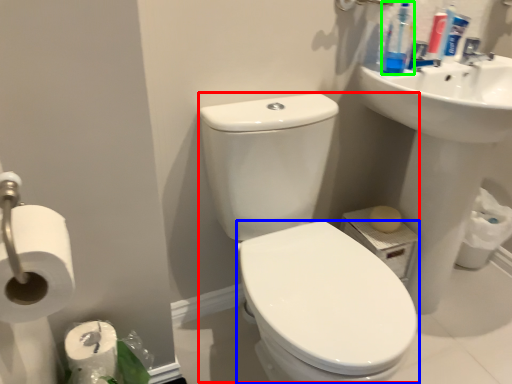
Question: Which object is positioned farthest from sink (highlighted by a red box)? Select from bidet (highlighted by a blue box) and cleaning product (highlighted by a green box).

Choices:
 (A) bidet
 (B) cleaning product

Answer: (B)